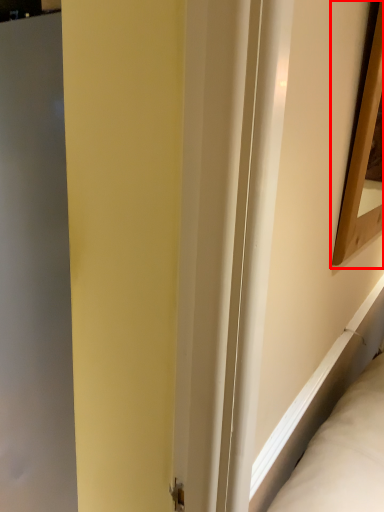
Question: Observing the image, what is the correct spatial positioning of picture frame (annotated by the red box) in reference to screen door?

Choices:
 (A) right
 (B) left

Answer: (A)